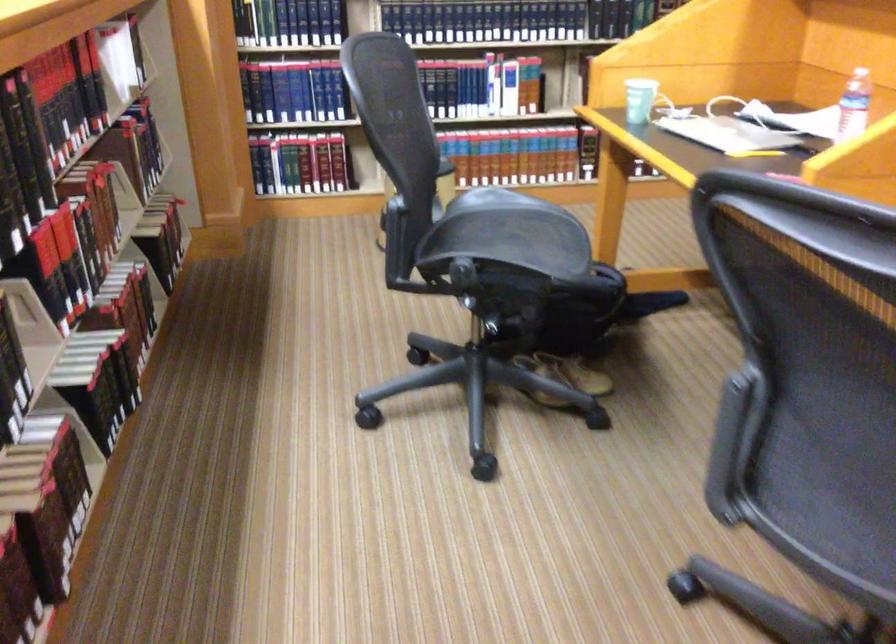
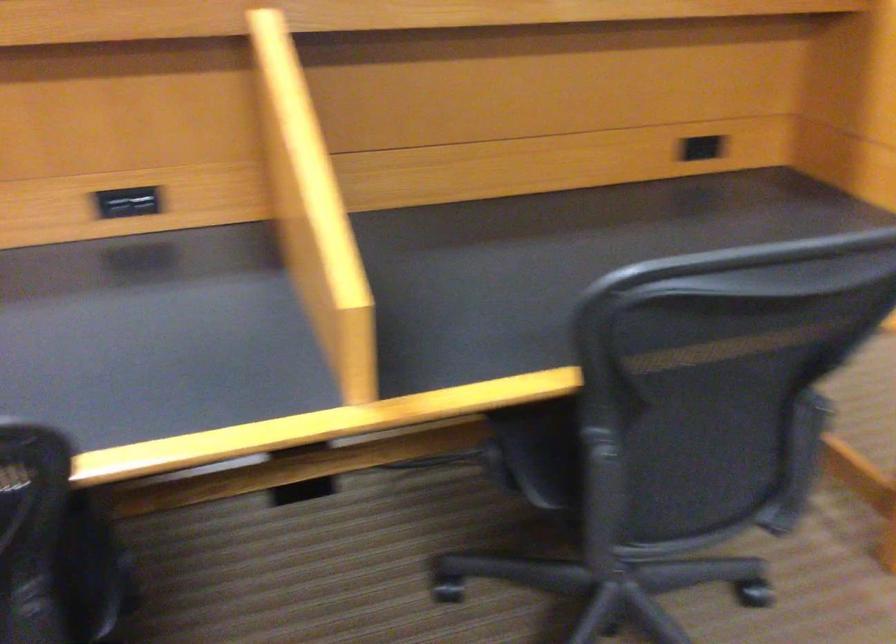
Question: I am providing you with two images of the same scene from different viewpoints. After the viewpoint changes to image2, which objects are now occluded?

Choices:
 (A) chair armrest
 (B) chair sitting surface
 (C) silver lamp arm
 (D) tan shoe

Answer: (D)